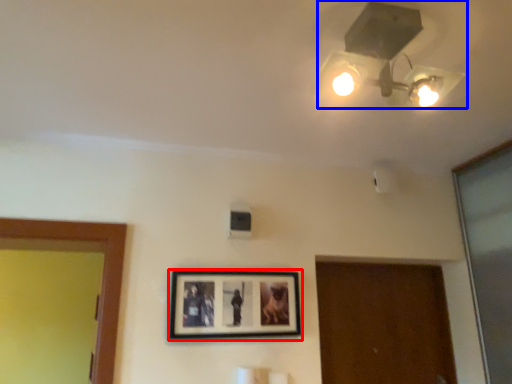
Question: Which point is closer to the camera, picture frame (highlighted by a red box) or lamp (highlighted by a blue box)?

Choices:
 (A) picture frame
 (B) lamp

Answer: (B)